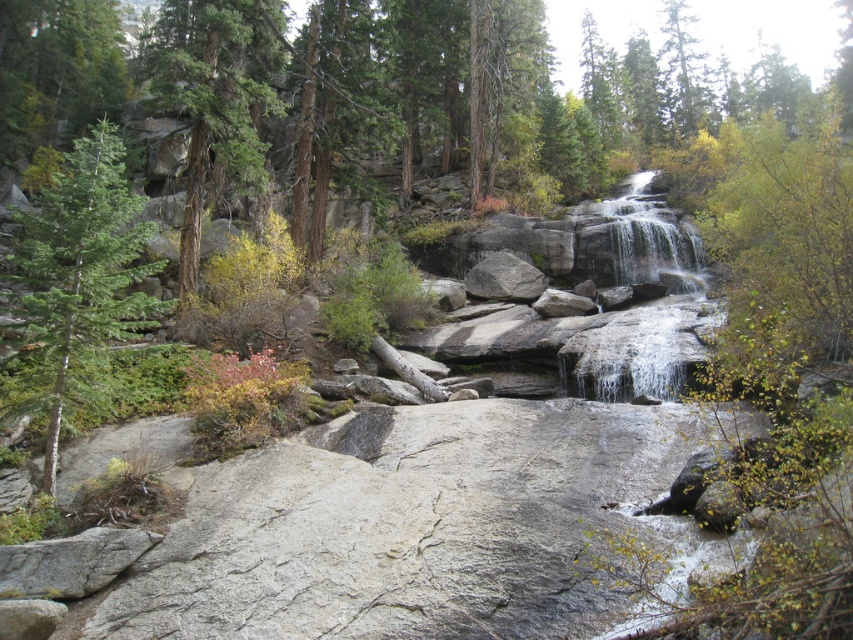
You are a hiker standing at the base of the waterfall. You notice a green matte tree at left and a green textured tree at upper center. Which tree is closer to you?

The green matte tree at left is closer to you because it is in front of the green textured tree at upper center.